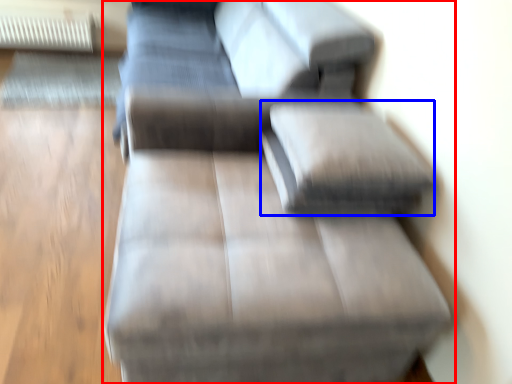
Question: Which point is further to the camera, studio couch (highlighted by a red box) or pillow (highlighted by a blue box)?

Choices:
 (A) studio couch
 (B) pillow

Answer: (B)